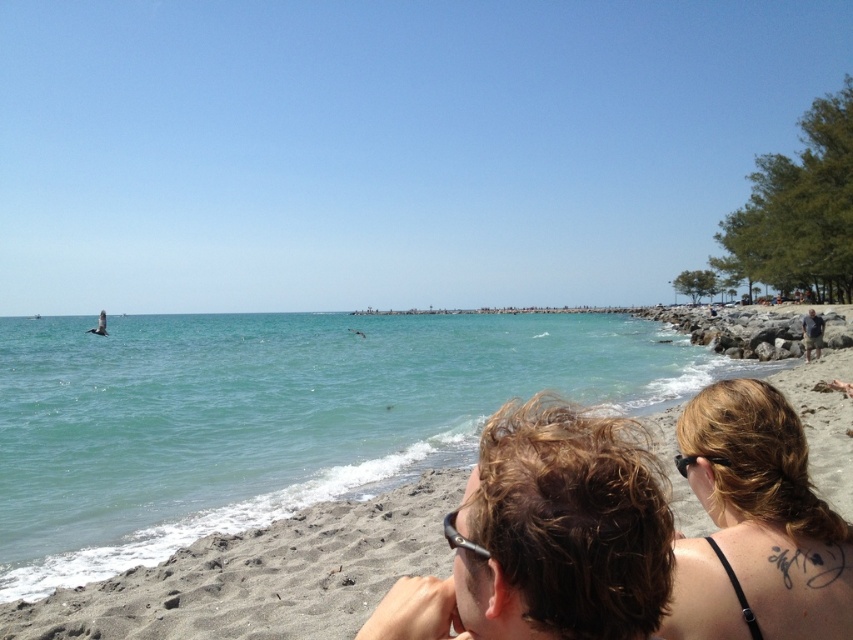
Describe the element at coordinates (270, 417) in the screenshot. I see `clear blue water at center` at that location.

Which is in front, point (416, 426) or point (651, 531)?

Point (651, 531) is in front.

The width and height of the screenshot is (853, 640). Identify the location of clear blue water at center. (270, 417).

Can you confirm if clear blue water at center is positioned to the right of dark gray shorts at right?

Incorrect, clear blue water at center is not on the right side of dark gray shorts at right.

Who is higher up, clear blue water at center or dark gray shorts at right?

dark gray shorts at right is above.

Where is `clear blue water at center`? clear blue water at center is located at coordinates (270, 417).

Locate an element on the screen. The width and height of the screenshot is (853, 640). clear blue water at center is located at coordinates (270, 417).

How far apart are brown hair at center and dark gray shorts at right?

brown hair at center and dark gray shorts at right are 94.17 feet apart from each other.

Can you confirm if brown hair at center is positioned to the left of dark gray shorts at right?

Yes, brown hair at center is to the left of dark gray shorts at right.

Is point (611, 516) more distant than point (805, 342)?

No, (611, 516) is in front of (805, 342).

Find the location of `brown hair at center`. brown hair at center is located at coordinates pos(547,536).